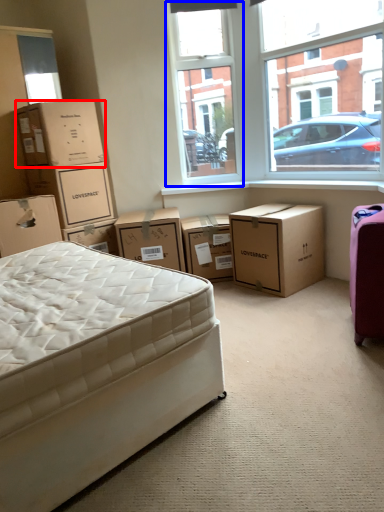
Question: Among these objects, which one is nearest to the camera, box (highlighted by a red box) or window screen (highlighted by a blue box)?

Choices:
 (A) box
 (B) window screen

Answer: (A)